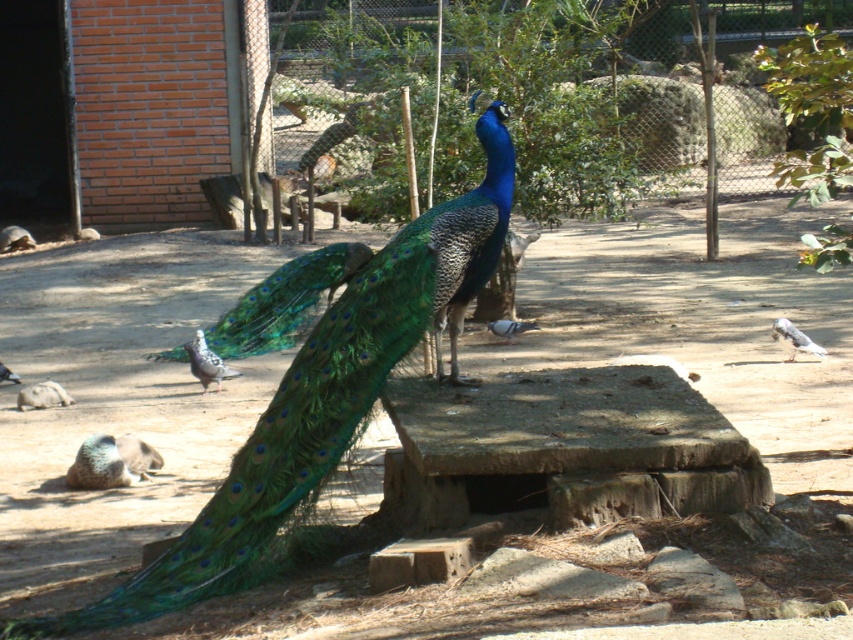
In the scene shown: You are standing at the center of the image and want to locate the gray speckled pigeon at lower left. Which direction should you look to find it?

The gray speckled pigeon at lower left is located at coordinates approximately 0.567 on the x axis and 0.243 on the y axis. Since the question is about direction from the center, the pigeon is to the lower left direction from the center point.

You are a birdwatcher observing the scene. You notice two pigeons in the image. Which pigeon is closer to you, the gray speckled pigeon at lower left or the gray matte pigeon at center?

The gray speckled pigeon at lower left is closer to you because it is positioned in front of the gray matte pigeon at center.